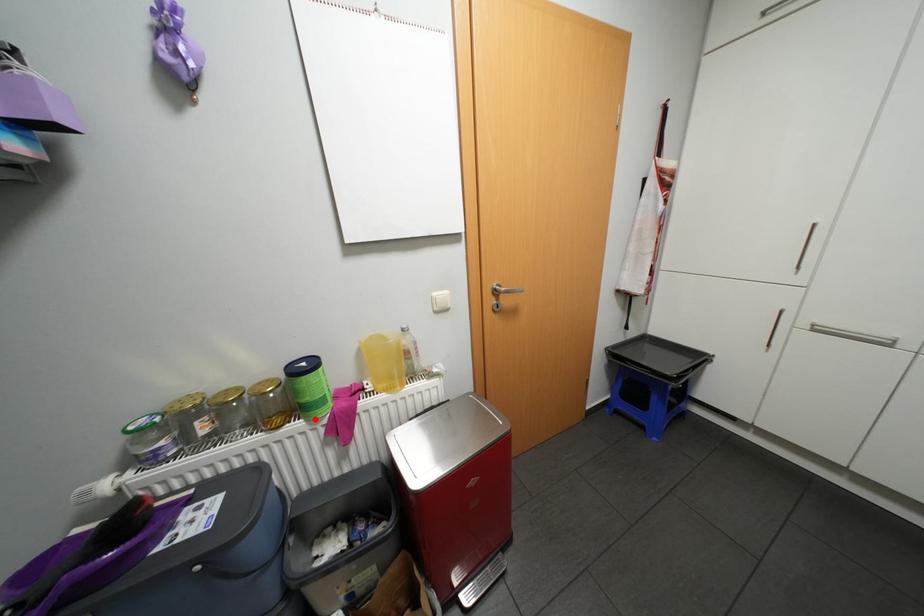
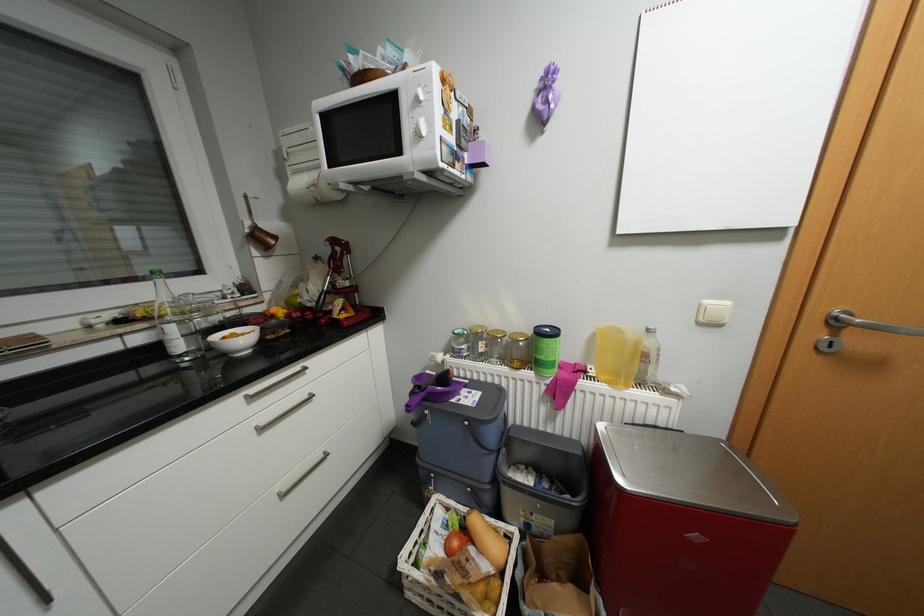
In the second image, find the point that corresponds to the highlighted location in the first image.

(544, 373)